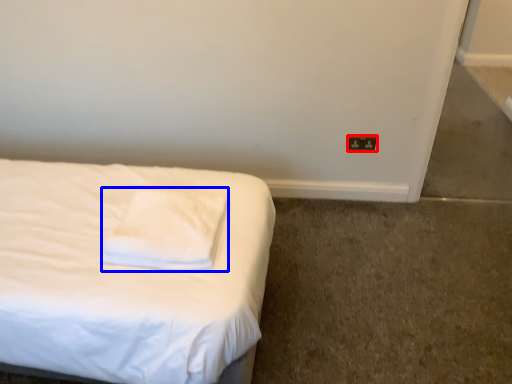
Question: Among these objects, which one is farthest to the camera, electric outlet (highlighted by a red box) or pillow (highlighted by a blue box)?

Choices:
 (A) electric outlet
 (B) pillow

Answer: (A)